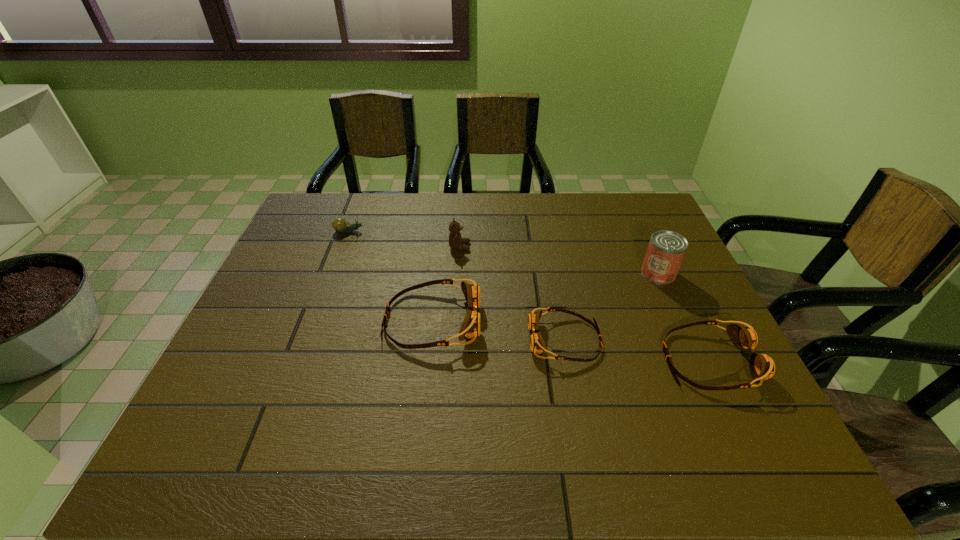
The width and height of the screenshot is (960, 540). In order to click on free spot between the second goggles from right to left and the third farthest object in this screenshot , I will do `click(612, 307)`.

Find the location of a particular element. The height and width of the screenshot is (540, 960). vacant point located between the fourth nearest object and the leftmost goggles is located at coordinates (545, 297).

Locate an element on the screen. free space between the second goggles from left to right and the leftmost goggles is located at coordinates (498, 330).

Select which object appears as the closest to the third farthest object. Please provide its 2D coordinates. Your answer should be formatted as a tuple, i.e. [(x, y)], where the tuple contains the x and y coordinates of a point satisfying the conditions above.

[(762, 367)]

Identify which object is the closest to the can. Please provide its 2D coordinates. Your answer should be formatted as a tuple, i.e. [(x, y)], where the tuple contains the x and y coordinates of a point satisfying the conditions above.

[(762, 367)]

This screenshot has width=960, height=540. I want to click on the second closest goggles to the leftmost goggles, so click(762, 367).

Point out which goggles is positioned as the nearest to the shortest goggles. Please provide its 2D coordinates. Your answer should be formatted as a tuple, i.e. [(x, y)], where the tuple contains the x and y coordinates of a point satisfying the conditions above.

[(470, 327)]